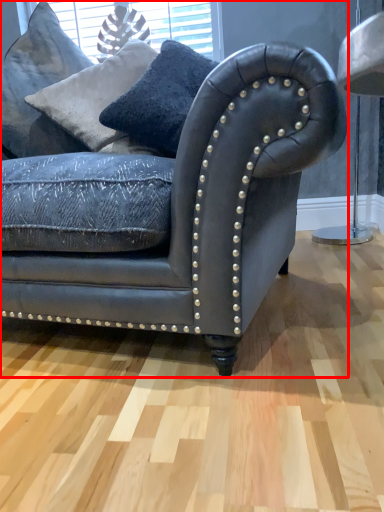
Question: From the image's perspective, where is studio couch (annotated by the red box) located in relation to pillow in the image?

Choices:
 (A) above
 (B) below

Answer: (B)